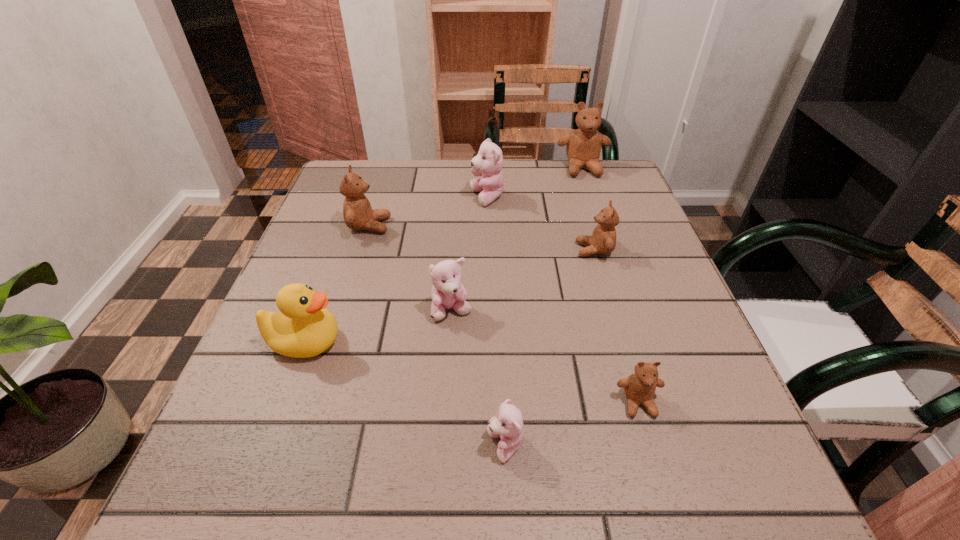
At what (x,y) coordinates should I click in order to perform the action: click on the farthest object. Please return your answer as a coordinate pair (x, y). Looking at the image, I should click on (583, 148).

Locate an element on the screen. This screenshot has width=960, height=540. the tallest teddy bear is located at coordinates [583, 148].

Image resolution: width=960 pixels, height=540 pixels. Identify the location of the seventh nearest object. [488, 163].

In order to click on the sixth nearest teddy bear in this screenshot , I will do `click(488, 163)`.

This screenshot has width=960, height=540. Identify the location of the leftmost brown teddy bear. (358, 214).

Find the location of a particular element. This screenshot has height=540, width=960. the leftmost teddy bear is located at coordinates (358, 214).

Locate an element on the screen. duck is located at coordinates (303, 328).

This screenshot has width=960, height=540. Find the location of `the second smallest brown teddy bear`. the second smallest brown teddy bear is located at coordinates pos(603,240).

Locate an element on the screen. The image size is (960, 540). the second biggest pink teddy bear is located at coordinates (447, 292).

This screenshot has width=960, height=540. I want to click on the fifth farthest teddy bear, so click(x=447, y=292).